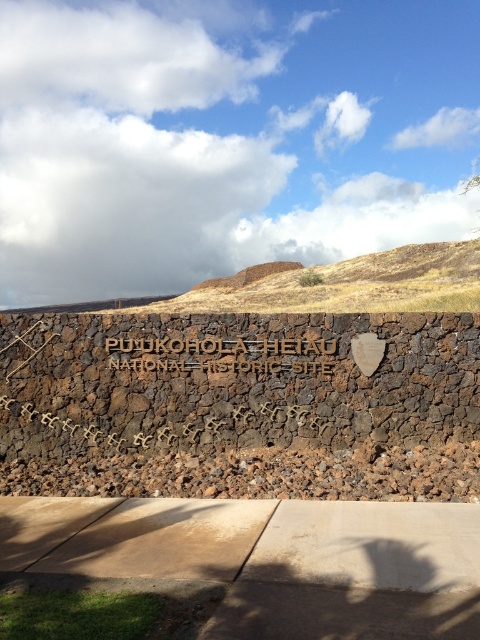
Question: Which point is closer to the camera?

Choices:
 (A) brown volcanic rock at center
 (B) gold textured sign at center

Answer: (B)

Question: Is brown volcanic rock at center positioned behind gold textured sign at center?

Choices:
 (A) yes
 (B) no

Answer: (A)

Question: Does brown volcanic rock at center lie behind gold textured sign at center?

Choices:
 (A) no
 (B) yes

Answer: (B)

Question: Among these points, which one is nearest to the camera?

Choices:
 (A) (120, 364)
 (B) (31, 477)

Answer: (B)

Question: Which point is farther to the camera?

Choices:
 (A) (173, 392)
 (B) (153, 353)

Answer: (B)

Question: Is brown volcanic rock at center closer to the viewer compared to gold textured sign at center?

Choices:
 (A) yes
 (B) no

Answer: (B)